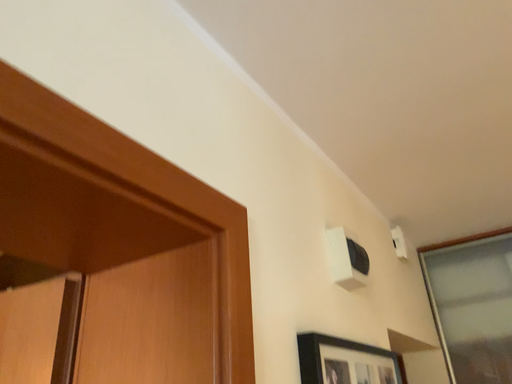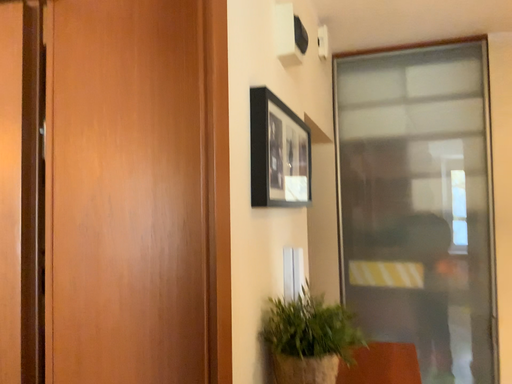
Question: Which way did the camera rotate in the video?

Choices:
 (A) rotated downward
 (B) rotated upward

Answer: (A)